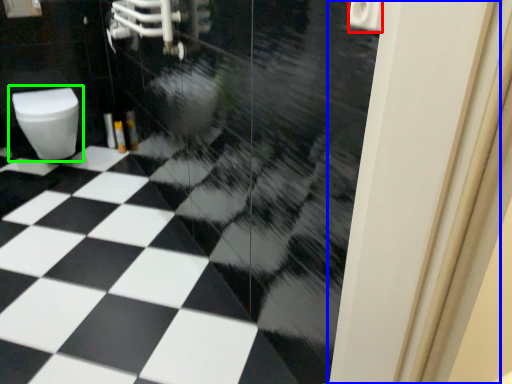
Question: Based on their relative distances, which object is farther from toilet paper (highlighted by a red box)? Choose from screen door (highlighted by a blue box) and toilet (highlighted by a green box).

Choices:
 (A) screen door
 (B) toilet

Answer: (B)